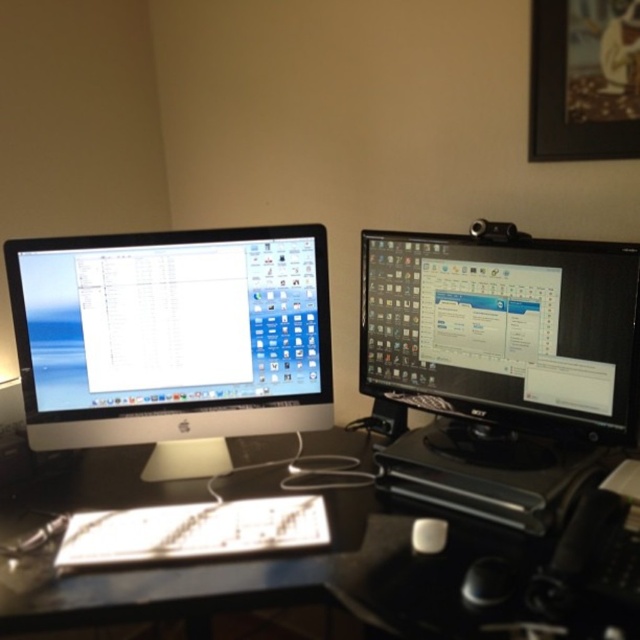
Is black glossy table at center bigger than black glossy monitor at right?

Yes.

Between black glossy table at center and black glossy monitor at right, which one appears on the right side from the viewer's perspective?

black glossy monitor at right

Where is `black glossy table at center`? Image resolution: width=640 pixels, height=640 pixels. black glossy table at center is located at coordinates (x=371, y=576).

Does satin black monitor at left appear over black glossy monitor at right?

No.

Is satin black monitor at left bigger than black glossy monitor at right?

No, satin black monitor at left is not bigger than black glossy monitor at right.

Is point (180, 294) closer to viewer compared to point (595, 323)?

That is False.

Identify the location of satin black monitor at left. The image size is (640, 640). (172, 333).

Does black glossy table at center appear on the right side of white matte mouse at center?

Incorrect, black glossy table at center is not on the right side of white matte mouse at center.

Is black glossy table at center smaller than white matte mouse at center?

Incorrect, black glossy table at center is not smaller in size than white matte mouse at center.

Who is more distant from viewer, [531,589] or [445,522]?

Point [445,522]

This screenshot has height=640, width=640. What are the coordinates of `black glossy table at center` in the screenshot? It's located at [x=371, y=576].